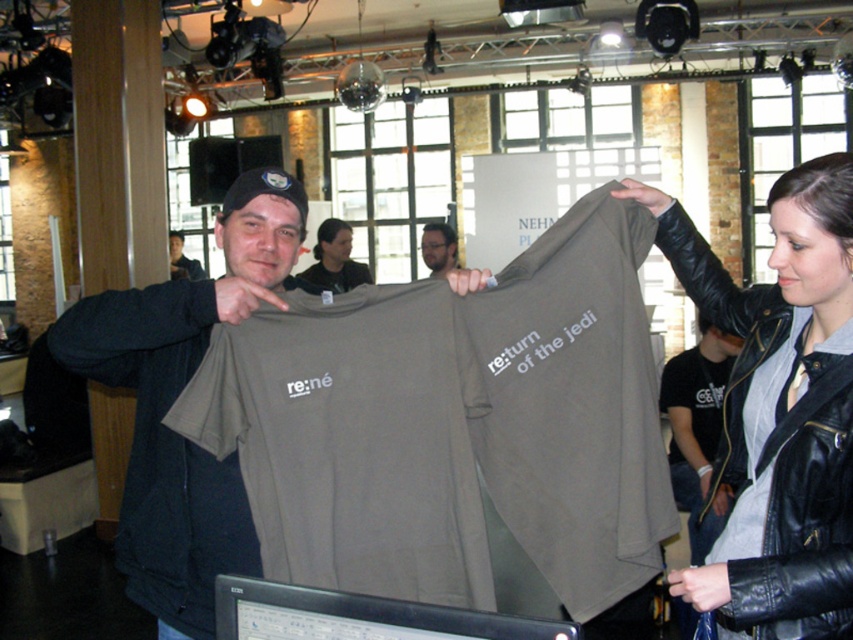
Is dark gray t-shirt at center wider than dark gray leather jacket at center?

No.

Is point (337, 237) closer to camera compared to point (172, 236)?

Yes, point (337, 237) is closer to viewer.

Identify the location of dark gray t-shirt at center. The width and height of the screenshot is (853, 640). (334, 259).

Is the position of dark gray t-shirt at center less distant than that of matte black t-shirt at center?

Yes, it is in front of matte black t-shirt at center.

Is point (326, 236) more distant than point (422, 257)?

Yes, it is behind point (422, 257).

Find the location of a particular element. dark gray t-shirt at center is located at coordinates (334, 259).

Consider the image. Is black leather jacket at upper right bigger than dark gray t-shirt at center?

Yes, black leather jacket at upper right is bigger than dark gray t-shirt at center.

Is black leather jacket at upper right shorter than dark gray t-shirt at center?

No, black leather jacket at upper right is not shorter than dark gray t-shirt at center.

You are a GUI agent. You are given a task and a screenshot of the screen. Output one action in this format:
    pyautogui.click(x=<x>, y=<y>)
    Task: Click on the black leather jacket at upper right
    This screenshot has height=640, width=853.
    Given the screenshot: What is the action you would take?
    pyautogui.click(x=779, y=410)

The image size is (853, 640). I want to click on black leather jacket at upper right, so click(779, 410).